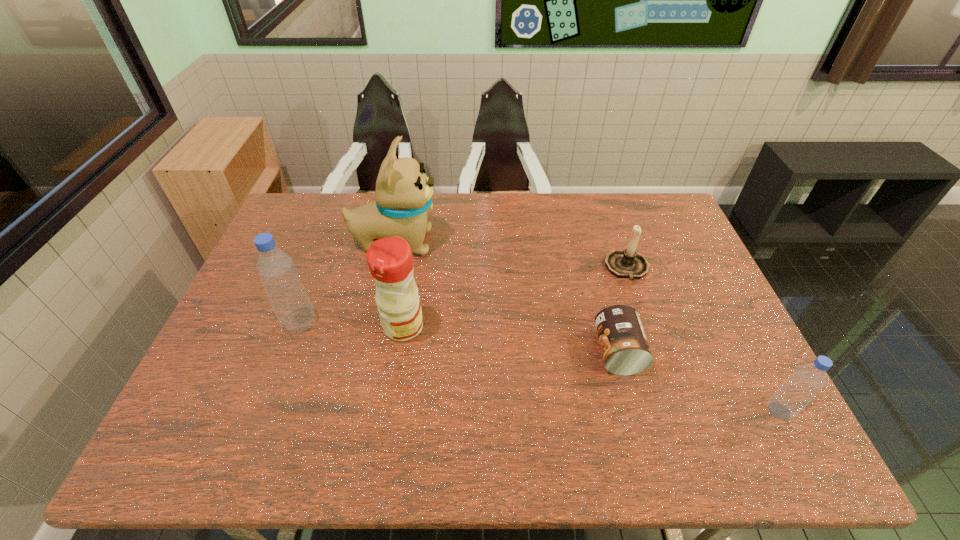
The image size is (960, 540). What are the coordinates of `object located in the near right corner section of the desktop` in the screenshot? It's located at (807, 380).

Where is `vacant space at the far edge of the desktop`? The image size is (960, 540). vacant space at the far edge of the desktop is located at coordinates (451, 206).

In order to click on blank space at the left edge in this screenshot , I will do pos(279,345).

Identify the location of blank space at the right edge of the desktop. (678, 310).

The height and width of the screenshot is (540, 960). Identify the location of vacant region at the far left corner. (315, 212).

Locate an element on the screen. blank area at the near left corner is located at coordinates [242, 401].

What are the coordinates of `vacant region at the far right corner` in the screenshot? It's located at (656, 192).

The height and width of the screenshot is (540, 960). What are the coordinates of `free spot between the taller bottle and the candle holder` in the screenshot? It's located at (464, 295).

Where is `vacant space in between the taller bottle and the can`? The image size is (960, 540). vacant space in between the taller bottle and the can is located at coordinates (459, 338).

Find the location of a particular element. The height and width of the screenshot is (540, 960). free area in between the nearer bottle and the shortest object is located at coordinates (699, 381).